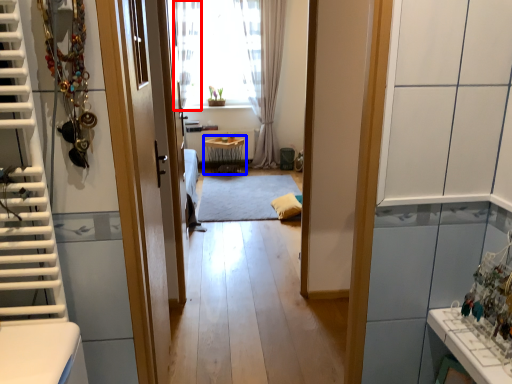
Question: Which of the following is the farthest to the observer, curtain (highlighted by a red box) or table (highlighted by a blue box)?

Choices:
 (A) curtain
 (B) table

Answer: (B)